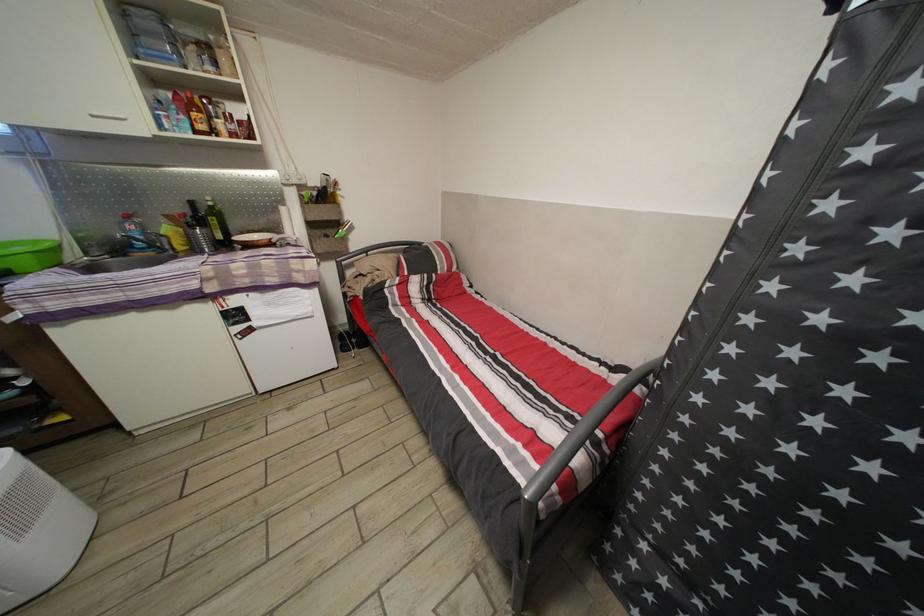
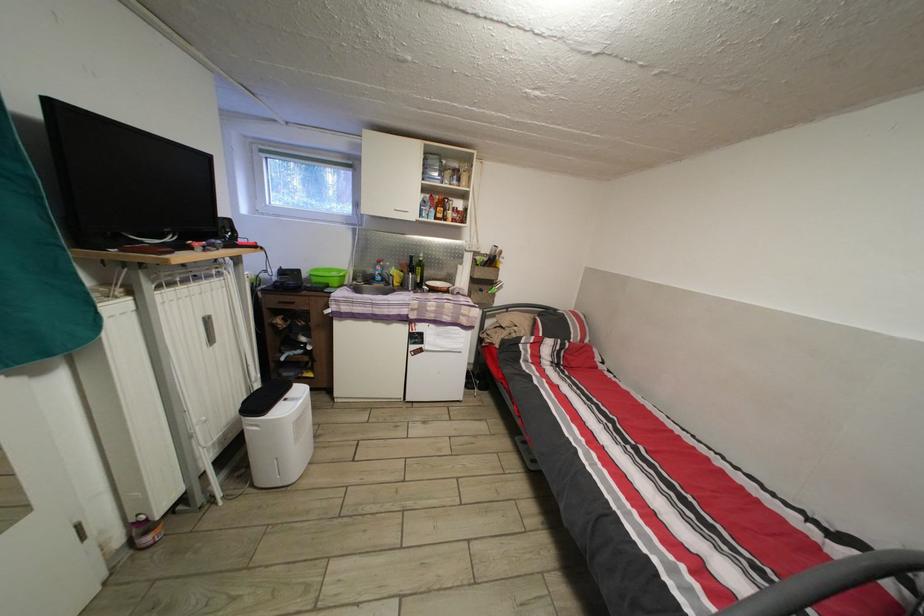
Where in the second image is the point corresponding to point 172,246 from the first image?

(398, 285)